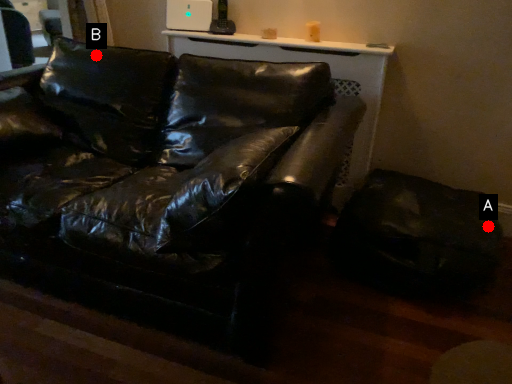
Question: Two points are circled on the image, labeled by A and B beside each circle. Which point is farther to the camera?

Choices:
 (A) A is further
 (B) B is further

Answer: (B)